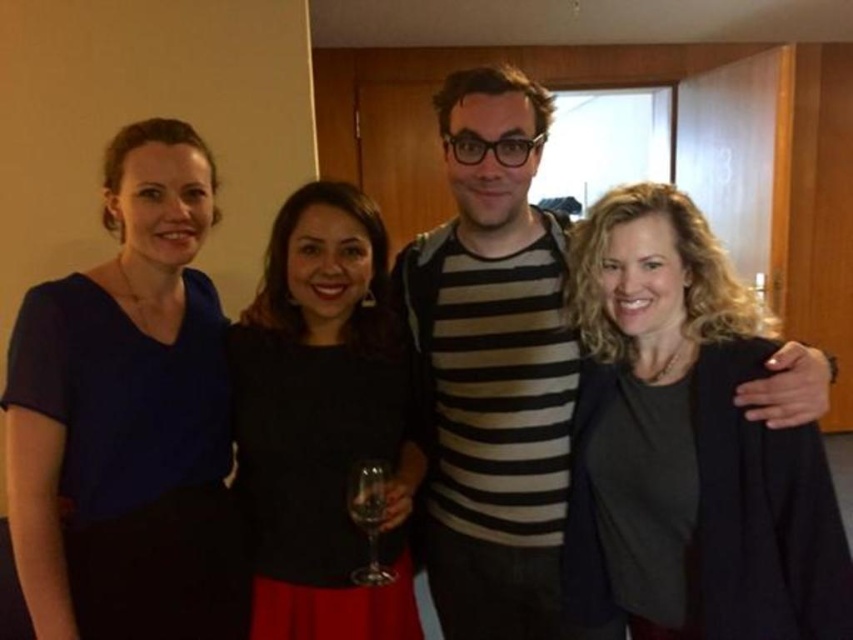
In the scene shown: Does blue matte dress at left have a larger size compared to transparent glass wine glass at center?

Yes, blue matte dress at left is bigger than transparent glass wine glass at center.

Who is higher up, blue matte dress at left or transparent glass wine glass at center?

Positioned higher is blue matte dress at left.

Find the location of a particular element. blue matte dress at left is located at coordinates (125, 413).

Is point (367, 484) closer to camera compared to point (358, 499)?

No, (367, 484) is behind (358, 499).

Is point (381, 499) positioned behind point (379, 518)?

That is True.

Locate an element on the screen. The height and width of the screenshot is (640, 853). transparent glass wine glass at center is located at coordinates (368, 516).

Is blue matte dress at left bigger than transparent glass at center?

Indeed, blue matte dress at left has a larger size compared to transparent glass at center.

Can you confirm if blue matte dress at left is shorter than transparent glass at center?

No, blue matte dress at left is not shorter than transparent glass at center.

Measure the distance between blue matte dress at left and camera.

The distance of blue matte dress at left from camera is 4.01 feet.

At what (x,y) coordinates should I click in order to perform the action: click on blue matte dress at left. Please return your answer as a coordinate pair (x, y). The width and height of the screenshot is (853, 640). Looking at the image, I should click on (125, 413).